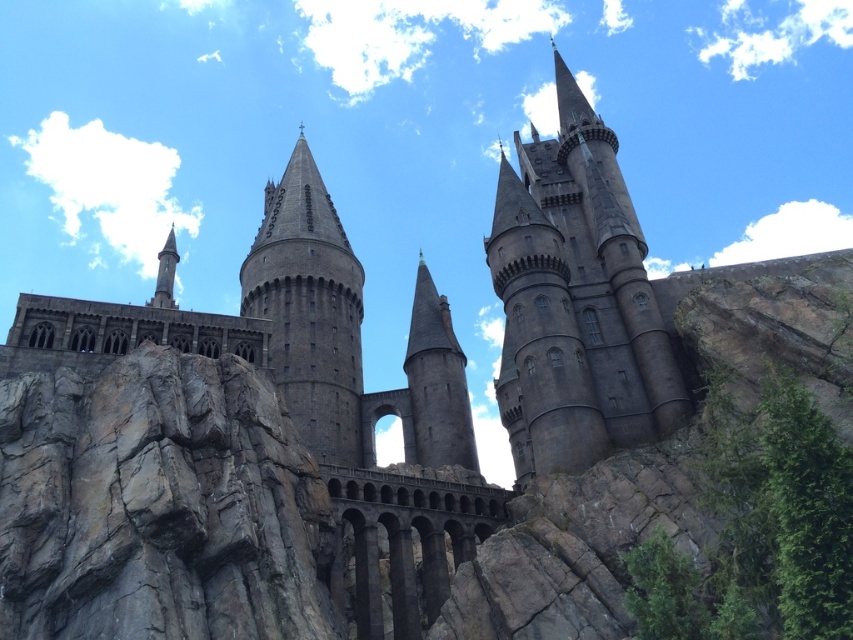
You are a knight approaching the castle from the cliff path. You see the gray rough rock at center and the dark stone tower at center. Which object would you encounter first as you approach the castle?

The gray rough rock at center is in front of the dark stone tower at center, so you would encounter the gray rough rock at center first as you approach the castle.